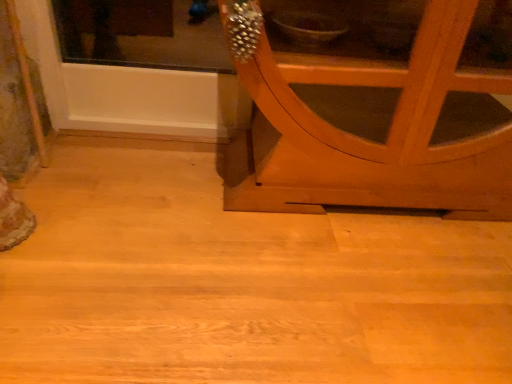
The image size is (512, 384). I want to click on free space in front of wooden cabinet at right, so click(308, 311).